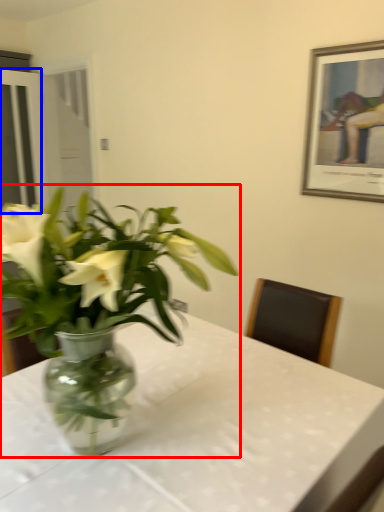
Question: Which of the following is the farthest to the observer, houseplant (highlighted by a red box) or glass door (highlighted by a blue box)?

Choices:
 (A) houseplant
 (B) glass door

Answer: (B)